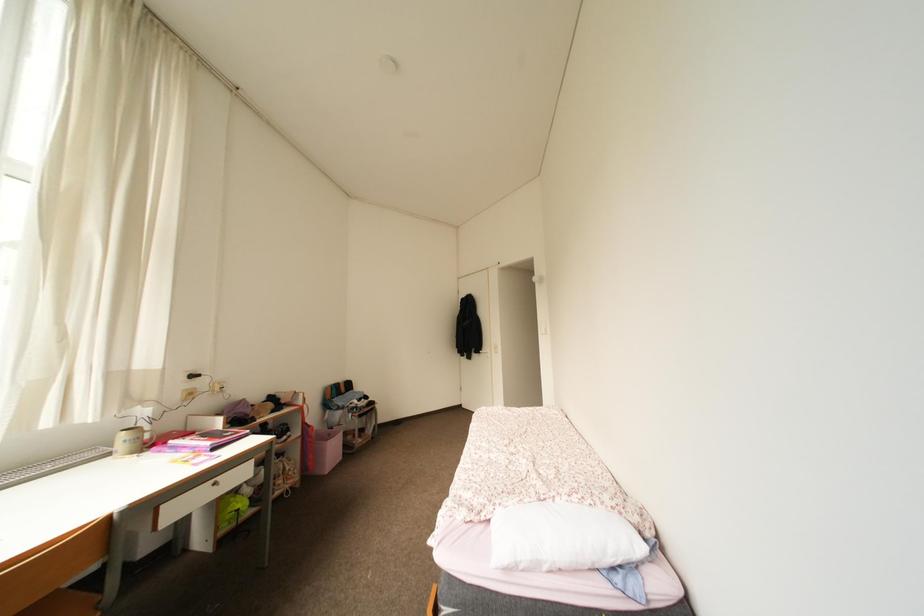
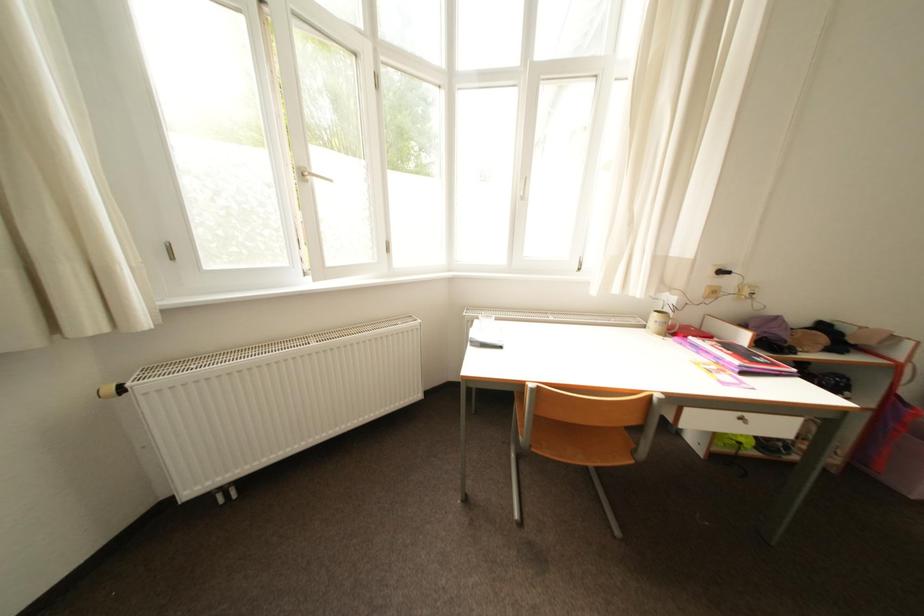
The first image is from the beginning of the video and the second image is from the end. How did the camera likely rotate when shooting the video?

The camera rotated toward left-down.